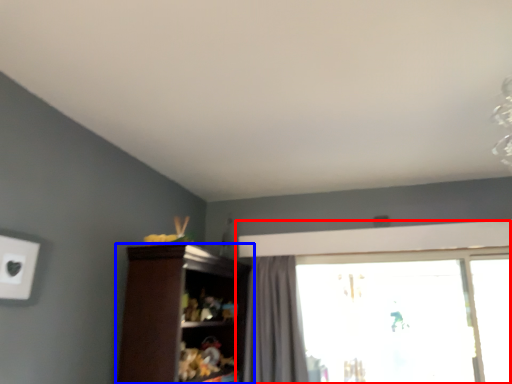
Question: Which object is closer to the camera taking this photo, window (highlighted by a red box) or cupboard (highlighted by a blue box)?

Choices:
 (A) window
 (B) cupboard

Answer: (B)